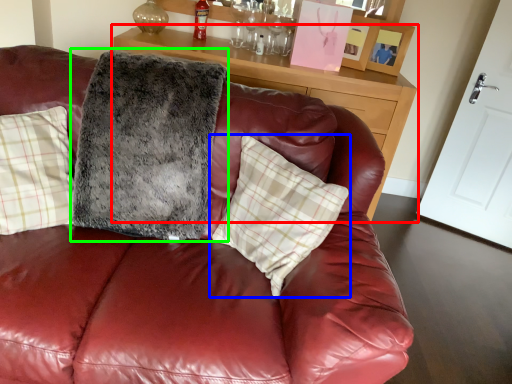
Question: Estimate the real-world distances between objects in this image. Which object is farther from table (highlighted by a red box), pillow (highlighted by a blue box) or blanket (highlighted by a green box)?

Choices:
 (A) pillow
 (B) blanket

Answer: (A)